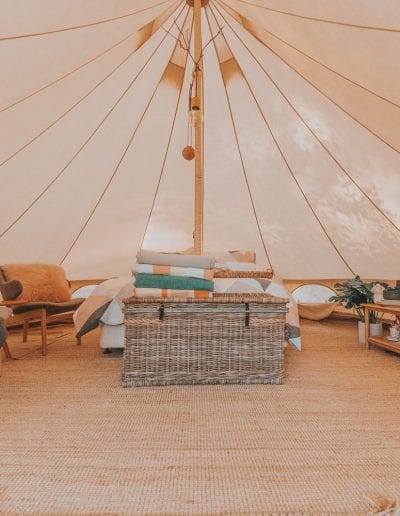
Where is `fuzzy seating`? fuzzy seating is located at coordinates (49, 295).